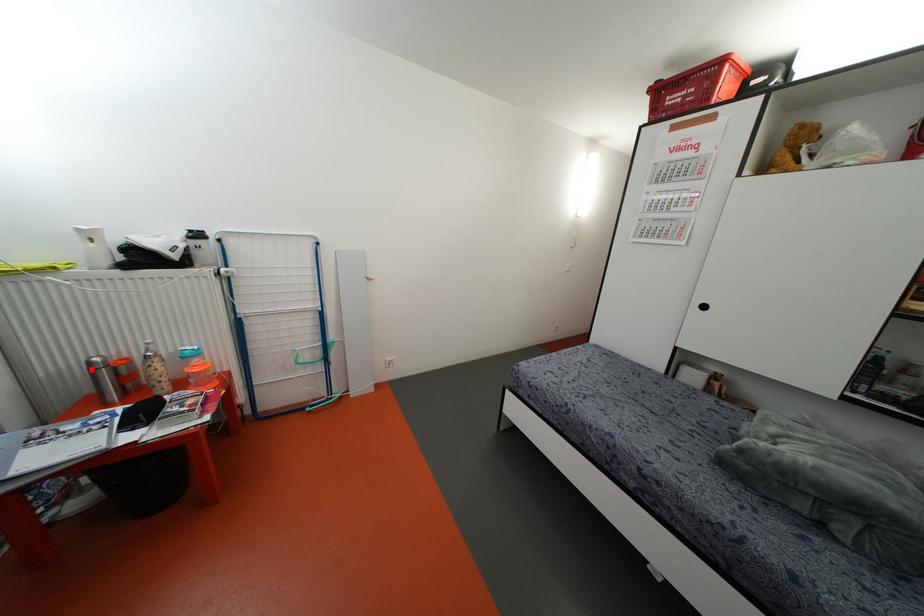
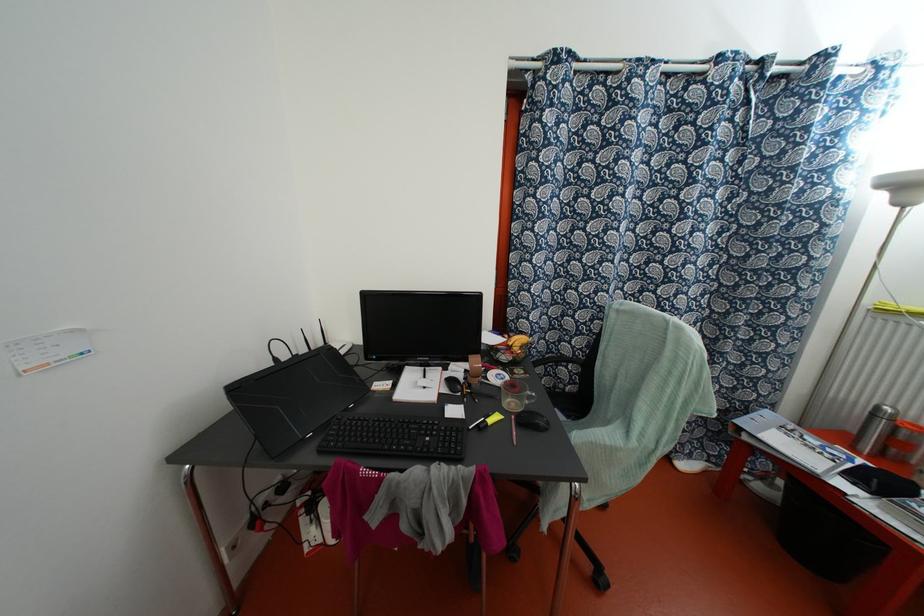
Question: I am providing you with two images of the same scene from different viewpoints. Image1 has a red point marked. In image2, the corresponding 3D location appears at what relative position? Reply with the corresponding letter.

Choices:
 (A) Closer
 (B) Farther

Answer: (B)